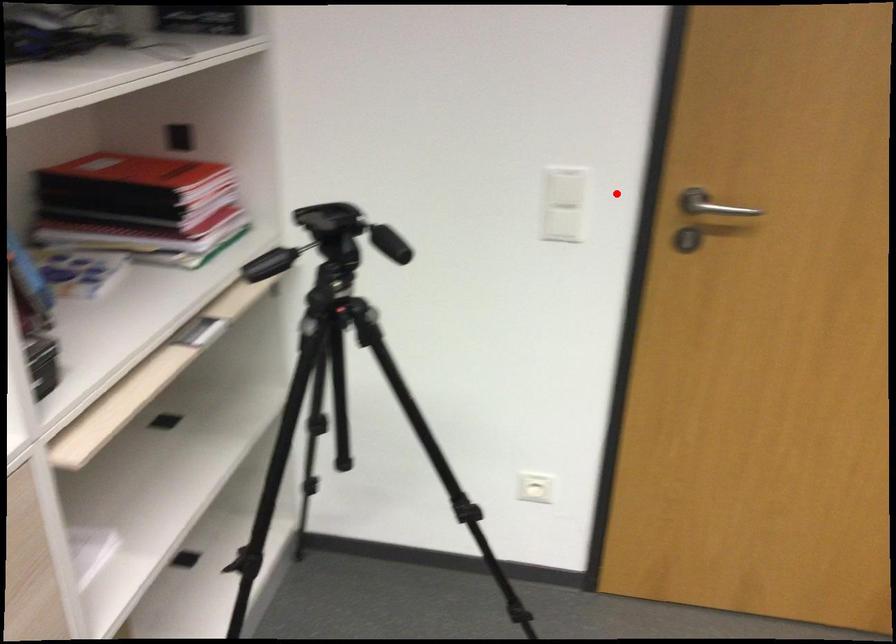
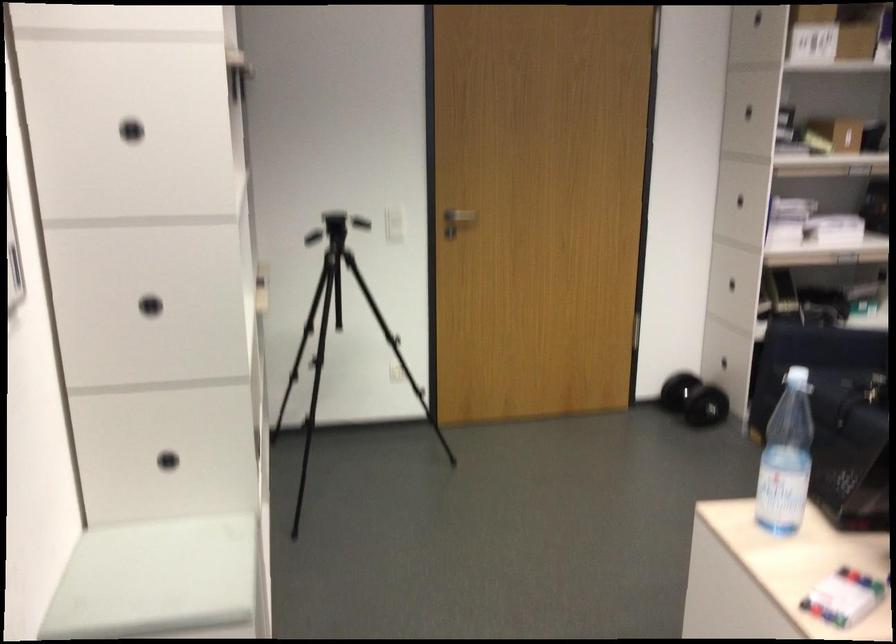
The point at the highlighted location is marked in the first image. Where is the corresponding point in the second image?

(393, 214)